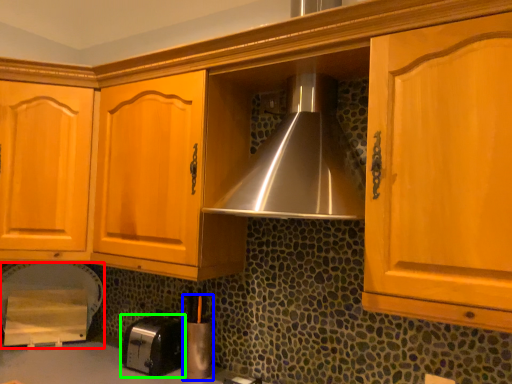
Question: Considering the real-world distances, which object is farthest from appliance (highlighted by a red box)? appliance (highlighted by a blue box) or toaster (highlighted by a green box)?

Choices:
 (A) appliance
 (B) toaster

Answer: (A)